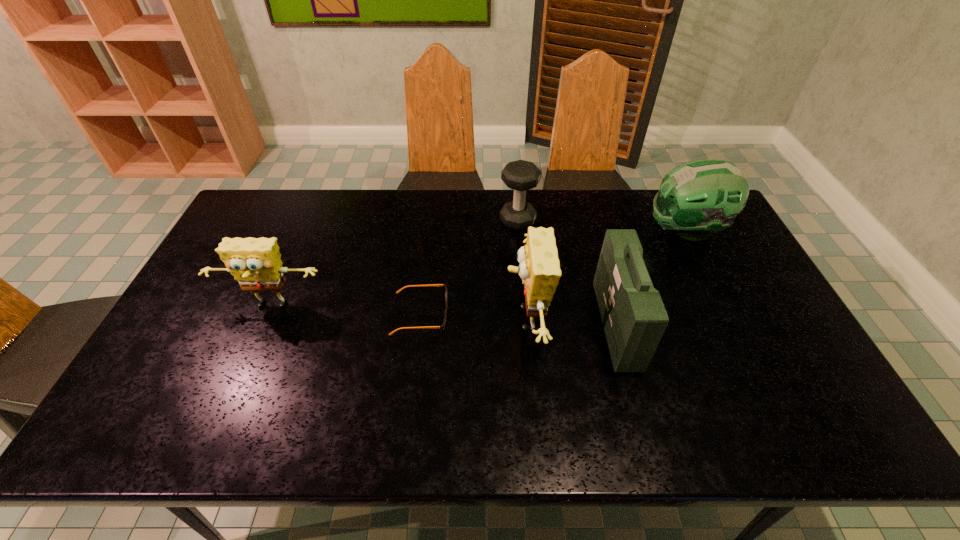
The height and width of the screenshot is (540, 960). In order to click on the left sponge in this screenshot , I will do `click(255, 263)`.

Image resolution: width=960 pixels, height=540 pixels. I want to click on the shorter sponge, so click(x=255, y=263).

Where is `the right sponge`? the right sponge is located at coordinates (539, 268).

Identify the location of dumbbell. This screenshot has height=540, width=960. (520, 175).

This screenshot has width=960, height=540. Identify the location of football helmet. (697, 198).

You are a GUI agent. You are given a task and a screenshot of the screen. Output one action in this format:
    pyautogui.click(x=<x>, y=<y>)
    Task: Click on the first-aid kit
    Image resolution: width=960 pixels, height=540 pixels.
    Given the screenshot: What is the action you would take?
    pyautogui.click(x=634, y=318)

At what (x,y) coordinates should I click in order to perform the action: click on spectacles. Please return your answer as a coordinate pair (x, y). The image size is (960, 540). Looking at the image, I should click on [x=442, y=327].

Locate an element on the screen. the shortest object is located at coordinates (442, 327).

I want to click on blank area located on the face of the shorter sponge, so click(x=234, y=395).

The width and height of the screenshot is (960, 540). I want to click on vacant region located 0.310m on the face of the taller sponge, so click(393, 320).